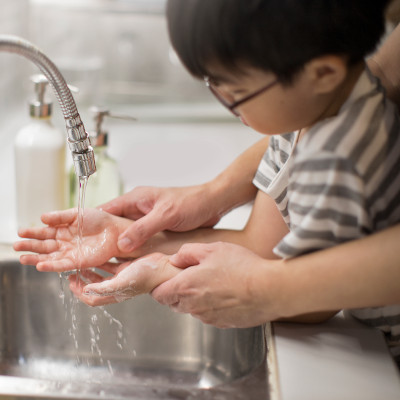
This screenshot has width=400, height=400. Identify the location of counter top. (310, 357), (177, 157).